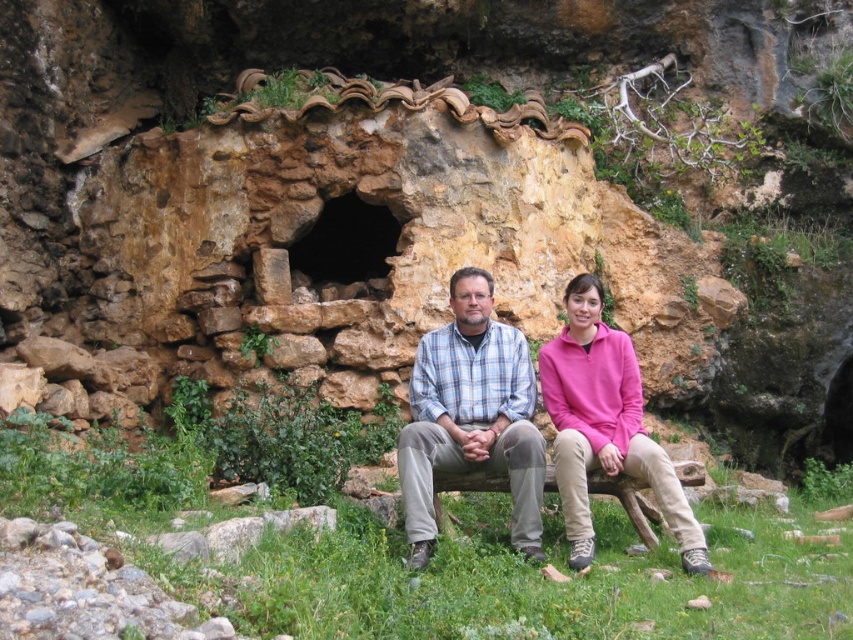
You are a photographer trying to capture a clear photo of the plaid fabric shirt at center and the brown stone cave at center. Since both are at center, which one will appear closer in the photo?

The plaid fabric shirt at center will appear closer in the photo because it is in front of the brown stone cave at center.

You are a photographer planning to take a portrait of two people sitting on the rustic wooden bench. You want to ensure that both the pink fleece at center and the brown stone cave at center are visible in the frame. Which object should you focus on to ensure both are in the shot without needing to adjust the camera angle?

The pink fleece at center is larger than the brown stone cave at center, so focusing on the pink fleece at center would help ensure both objects are captured in the frame without needing to adjust the camera angle.

Consider the image. You are standing at the scene and want to take a photo of the plaid fabric shirt at center. If your camera has a maximum focus range of 30 meters, will you be able to capture the shirt clearly?

The plaid fabric shirt at center and viewer are 32.66 meters apart, which exceeds the camera maximum focus range of 30 meters. Therefore, the camera cannot focus on the plaid fabric shirt at center clearly.